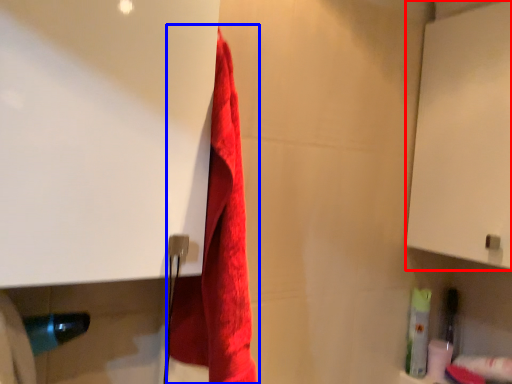
Question: Which object appears closest to the camera in this image, screen door (highlighted by a red box) or towel (highlighted by a blue box)?

Choices:
 (A) screen door
 (B) towel

Answer: (B)